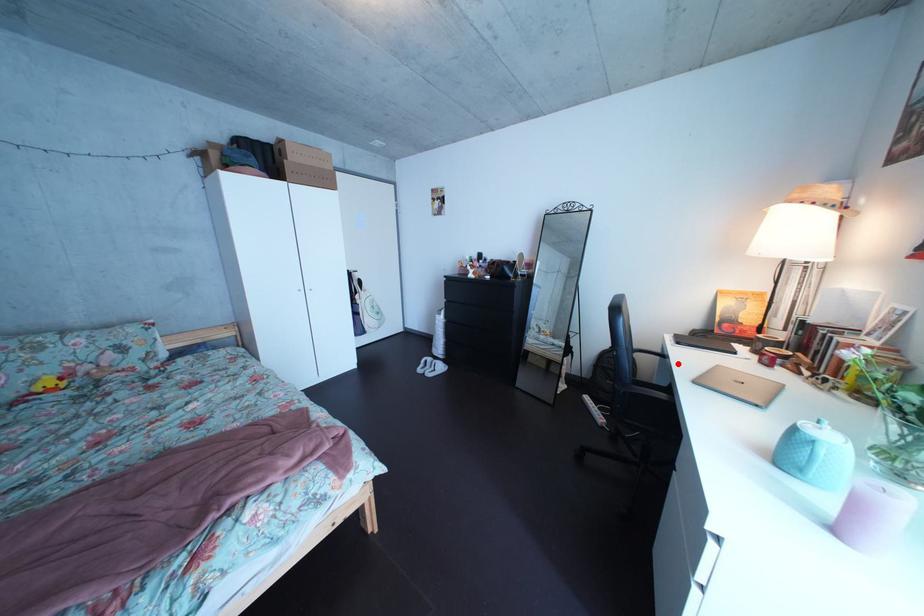
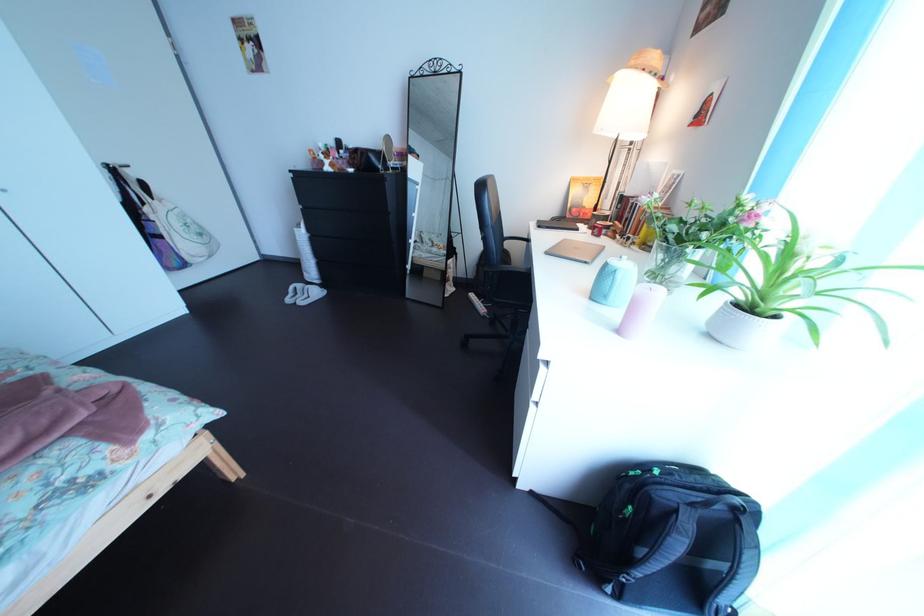
Find the pixel in the second image that matches the highlighted location in the first image.

(541, 248)